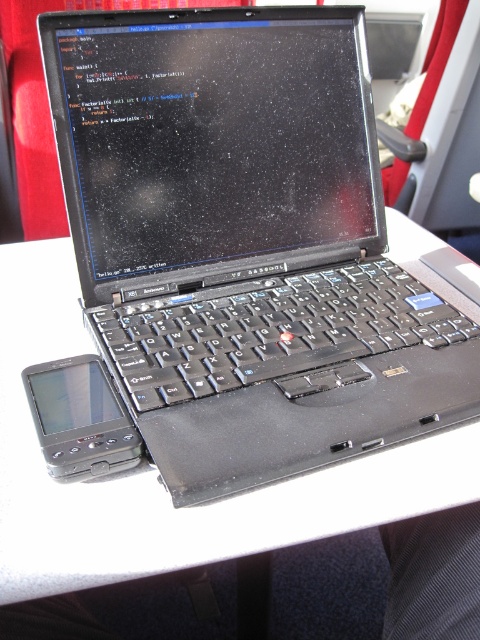
You are packing your bag for a trip and need to decide whether to bring both the white plastic table at center and the black plastic smartphone at lower left. Given their sizes, which one should you prioritize packing first to ensure they both fit in your bag?

The white plastic table at center is larger in size than the black plastic smartphone at lower left. You should prioritize packing the white plastic table at center first to ensure it fits, then the smartphone will have more space left.

You are a photographer taking a picture of the laptop screen. You notice two points on the screen at coordinates point [9,563] and point [38,388]. Which point will appear larger in your photo?

Point [9,563] is closer to the camera than point [38,388], so it will appear larger in the photo.

You are a passenger on a train and need to place a small item between the black matte laptop at center and the black plastic smartphone at lower left. Based on their positions, which object should you move closer to you to create space?

The black matte laptop at center is closer to the viewer than the black plastic smartphone at lower left. To create space between them, you should move the black matte laptop at center away from you towards the black plastic smartphone at lower left.